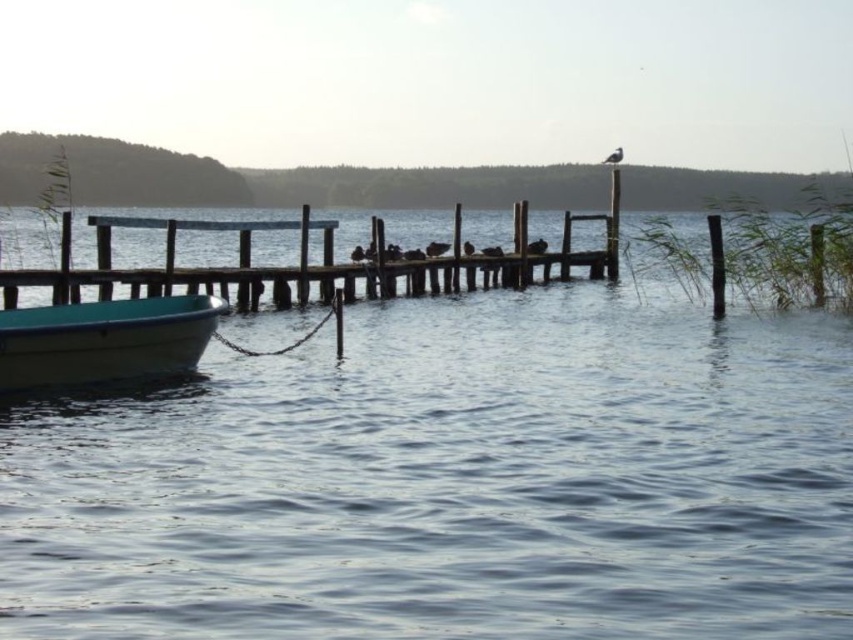
You are standing on the dock and notice the clear blue water at center and the white plastic boat at lower left. Which object appears taller from your perspective?

The clear blue water at center appears taller than the white plastic boat at lower left because it has a greater height compared to the boat.